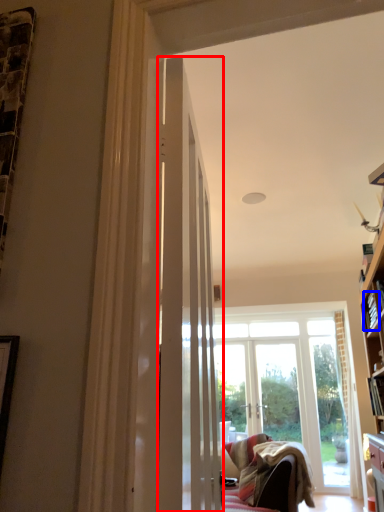
Question: Which object is further to the camera taking this photo, door (highlighted by a red box) or book (highlighted by a blue box)?

Choices:
 (A) door
 (B) book

Answer: (B)